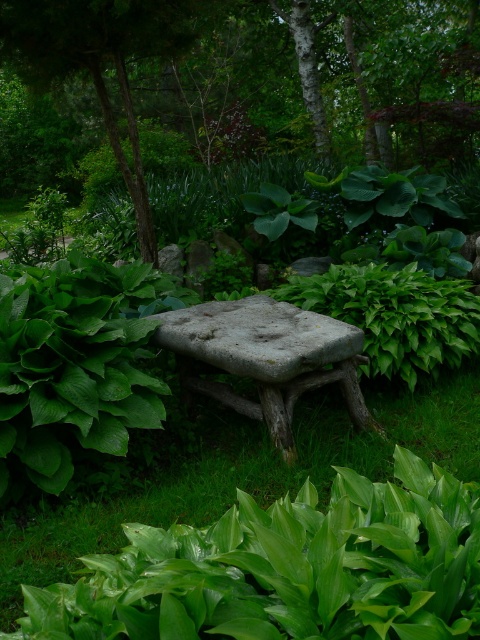
You are standing in the garden looking at the stone bench. There are two points marked on the bench. Which point is closer to you, point (250, 445) or point (354, 346)?

Point (354, 346) is closer to you because it is less further to the camera than point (250, 445).

You are a gardener standing in the garden and want to sit on the rough stone bench at center. Can you see the bench clearly from your current position in front of the green leafy tree at center?

The rough stone bench at center is behind the green leafy tree at center, so you cannot see it clearly from in front of the green leafy tree at center.